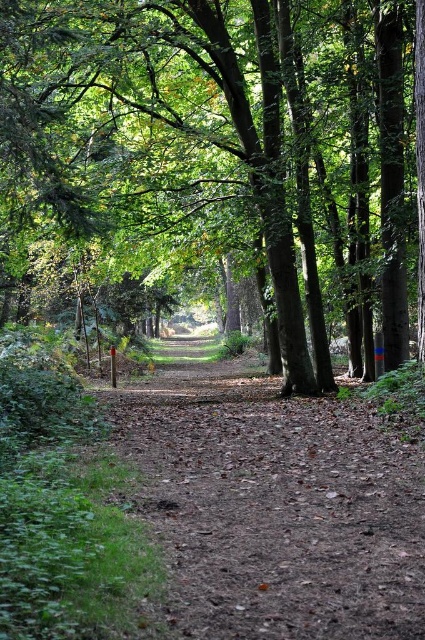
Question: Can you confirm if brown textured tree at center is positioned to the right of dirt path at center?

Choices:
 (A) yes
 (B) no

Answer: (B)

Question: Is brown textured tree at center to the right of dirt path at center from the viewer's perspective?

Choices:
 (A) yes
 (B) no

Answer: (B)

Question: Among these objects, which one is farthest from the camera?

Choices:
 (A) brown textured tree at center
 (B) dirt path at center

Answer: (A)

Question: Can you confirm if brown textured tree at center is positioned below dirt path at center?

Choices:
 (A) yes
 (B) no

Answer: (B)